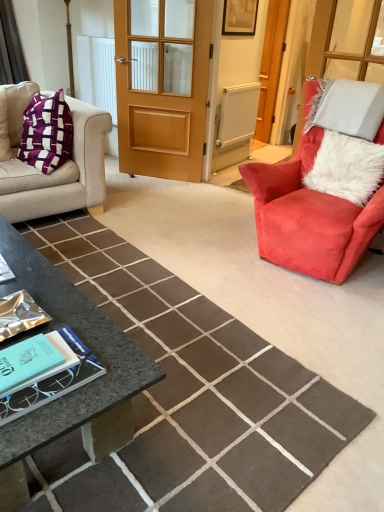
The image size is (384, 512). I want to click on vacant space behind teal matte book at lower left, so click(x=76, y=316).